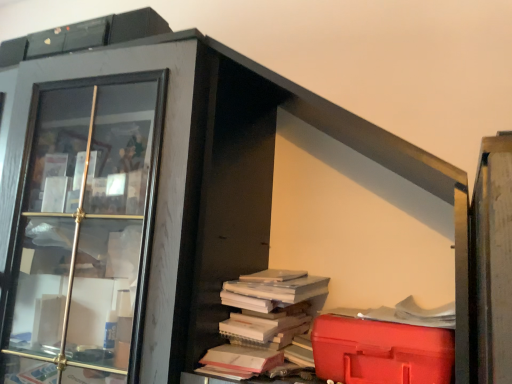
Question: Is red plastic toolbox at lower right positioned far away from matte glass cabinet at left?

Choices:
 (A) no
 (B) yes

Answer: (A)

Question: Is red plastic toolbox at lower right located outside matte glass cabinet at left?

Choices:
 (A) yes
 (B) no

Answer: (A)

Question: Considering the relative positions of red plastic toolbox at lower right and matte glass cabinet at left in the image provided, is red plastic toolbox at lower right in front of matte glass cabinet at left?

Choices:
 (A) no
 (B) yes

Answer: (A)

Question: Is red plastic toolbox at lower right further to the viewer compared to matte glass cabinet at left?

Choices:
 (A) yes
 (B) no

Answer: (A)

Question: From the image's perspective, is red plastic toolbox at lower right above matte glass cabinet at left?

Choices:
 (A) no
 (B) yes

Answer: (A)

Question: Considering the relative sizes of red plastic toolbox at lower right and matte glass cabinet at left in the image provided, is red plastic toolbox at lower right smaller than matte glass cabinet at left?

Choices:
 (A) yes
 (B) no

Answer: (A)

Question: Is white paper book at center aimed at red plastic toolbox at lower right?

Choices:
 (A) yes
 (B) no

Answer: (B)

Question: Is white paper book at center positioned with its back to red plastic toolbox at lower right?

Choices:
 (A) no
 (B) yes

Answer: (A)

Question: Is red plastic toolbox at lower right surrounded by white paper book at center?

Choices:
 (A) yes
 (B) no

Answer: (B)

Question: Is white paper book at center completely or partially outside of red plastic toolbox at lower right?

Choices:
 (A) no
 (B) yes

Answer: (B)

Question: Is white paper book at center with red plastic toolbox at lower right?

Choices:
 (A) yes
 (B) no

Answer: (B)

Question: Can you confirm if white paper book at center is wider than red plastic toolbox at lower right?

Choices:
 (A) yes
 (B) no

Answer: (A)

Question: Can you confirm if white paper book at center is shorter than matte glass cabinet at left?

Choices:
 (A) yes
 (B) no

Answer: (A)